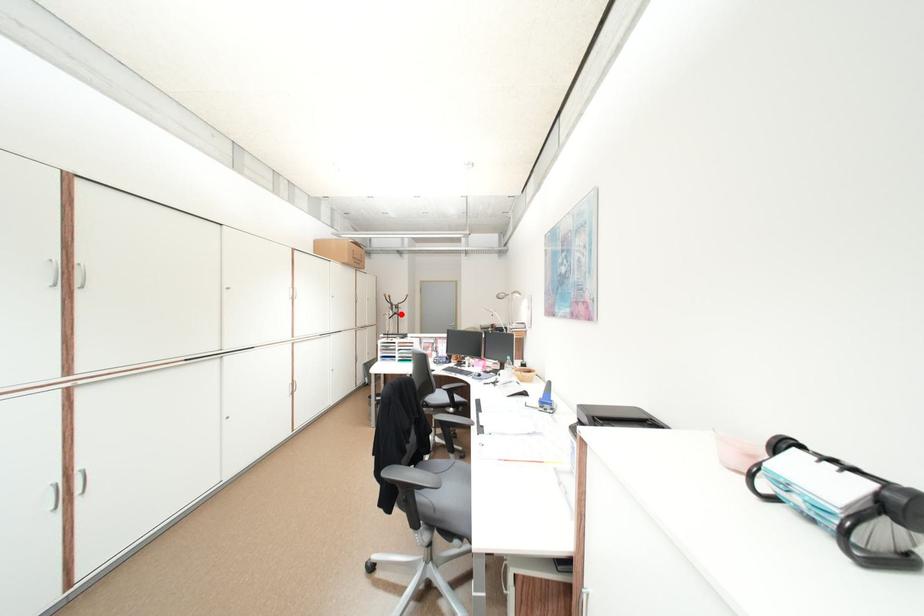
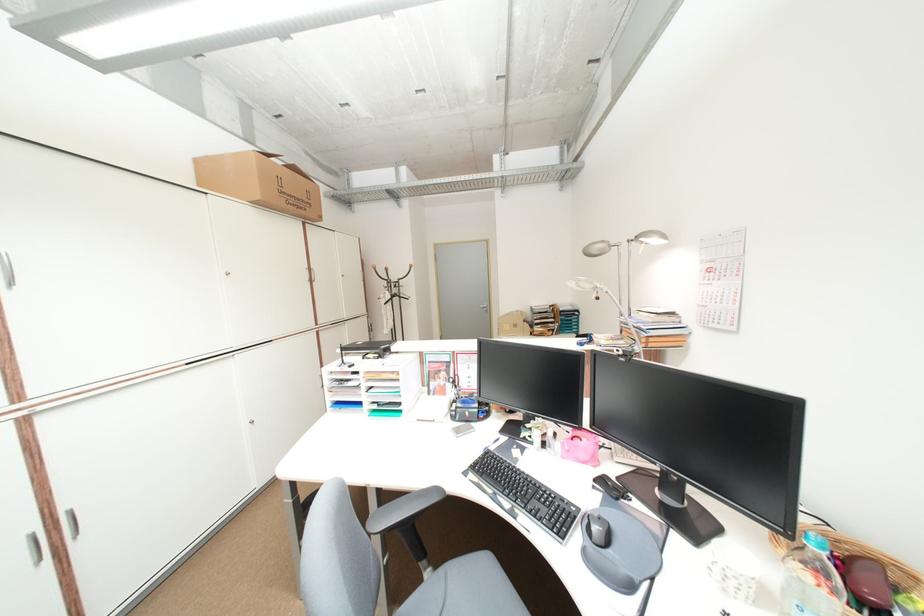
Question: A red point is marked in image1. In image2, is the corresponding 3D point closer to the camera or farther? Reply with the corresponding letter.

Choices:
 (A) The corresponding 3D point is closer.
 (B) The corresponding 3D point is farther.

Answer: (B)